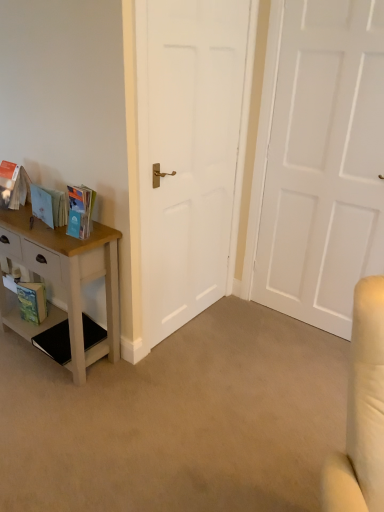
Identify the location of free location to the right of matte blue book at left, placed as the third book when sorted from left to right. The height and width of the screenshot is (512, 384). (103, 234).